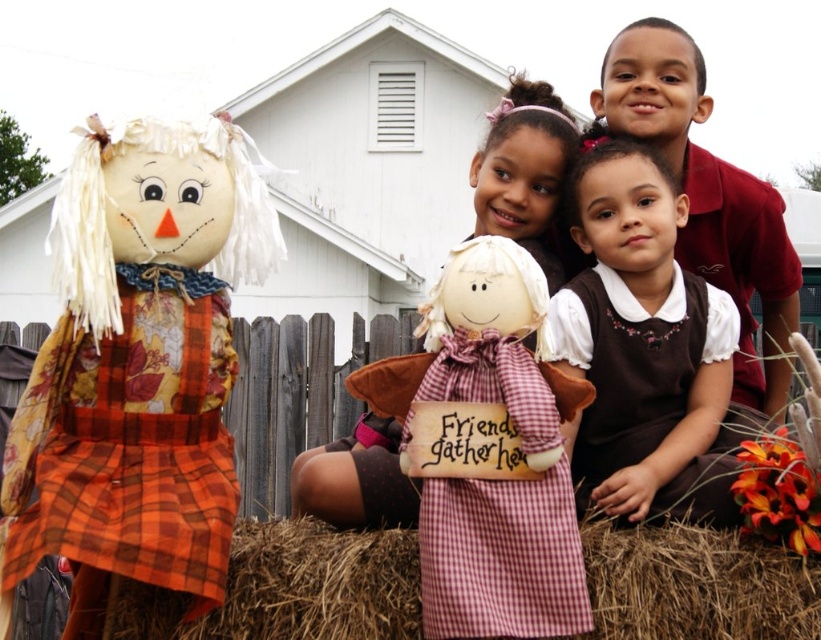
Does matte plaid scarecrow at left appear over red checkered fabric doll at center?

Correct, matte plaid scarecrow at left is located above red checkered fabric doll at center.

Is matte plaid scarecrow at left below red checkered fabric doll at center?

Incorrect, matte plaid scarecrow at left is not positioned below red checkered fabric doll at center.

Does point (173, 154) come farther from viewer compared to point (562, 592)?

Yes, it is.

You are a GUI agent. You are given a task and a screenshot of the screen. Output one action in this format:
    pyautogui.click(x=<x>, y=<y>)
    Task: Click on the matte plaid scarecrow at left
    
    Given the screenshot: What is the action you would take?
    point(138,365)

Does red checkered fabric doll at center have a smaller size compared to white fabric doll at center?

Yes, red checkered fabric doll at center is smaller than white fabric doll at center.

Who is higher up, red checkered fabric doll at center or white fabric doll at center?

Positioned higher is white fabric doll at center.

Measure the distance between red checkered fabric doll at center and camera.

red checkered fabric doll at center is 22.58 feet away from camera.

The image size is (821, 640). In order to click on red checkered fabric doll at center in this screenshot , I will do `click(500, 509)`.

Does point (166, 204) come farther from viewer compared to point (498, 227)?

No, it is not.

Between point (242, 140) and point (351, 515), which one is positioned behind?

The point (351, 515) is more distant.

This screenshot has height=640, width=821. I want to click on matte plaid scarecrow at left, so click(138, 365).